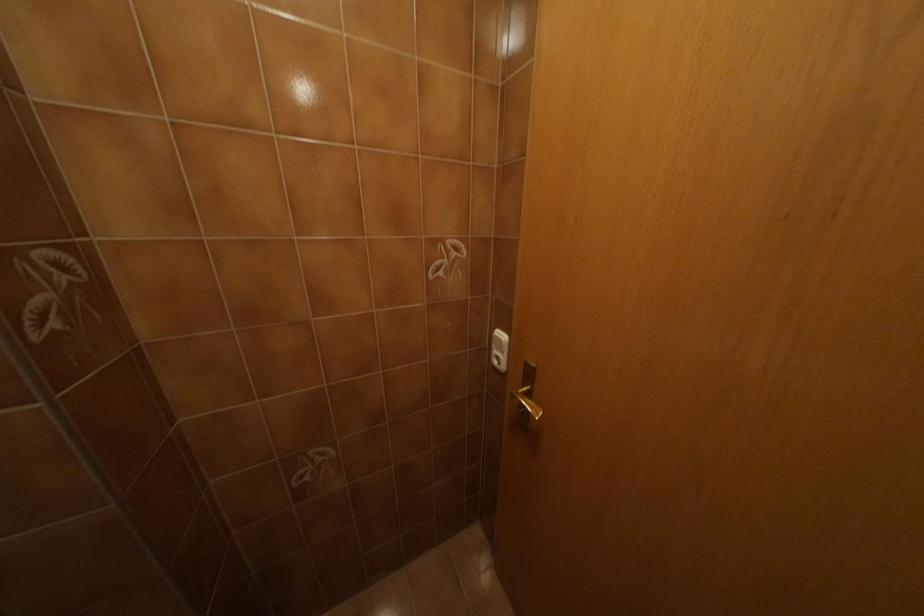
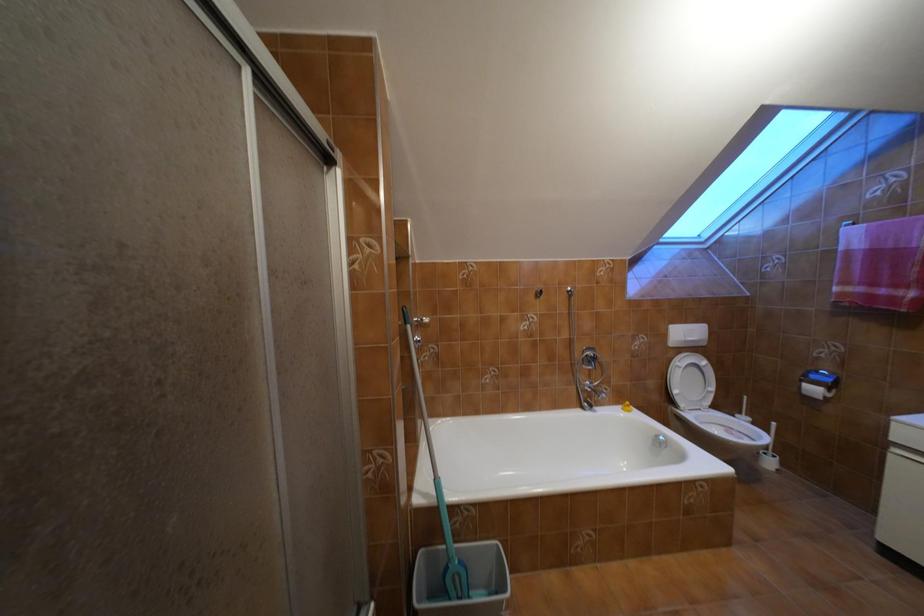
Question: How did the camera likely rotate?

Choices:
 (A) Left
 (B) Right
 (C) Up
 (D) Down

Answer: (A)